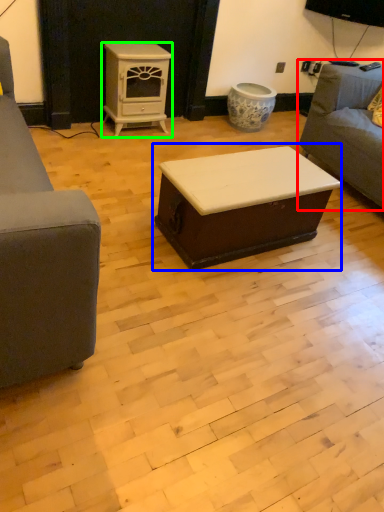
Question: Considering the real-world distances, which object is farthest from studio couch (highlighted by a red box)? table (highlighted by a blue box) or appliance (highlighted by a green box)?

Choices:
 (A) table
 (B) appliance

Answer: (B)